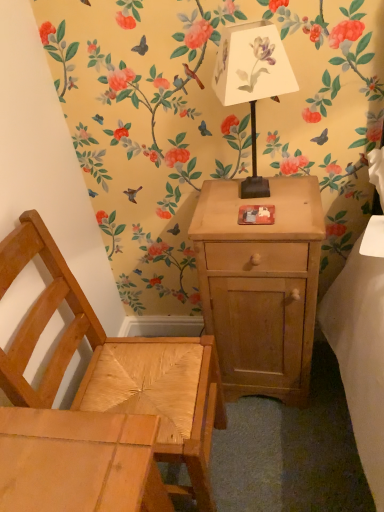
Question: From a real-world perspective, is natural wood chair at lower left below light brown wood nightstand at center?

Choices:
 (A) yes
 (B) no

Answer: (B)

Question: Is light brown wood nightstand at center a part of natural wood chair at lower left?

Choices:
 (A) no
 (B) yes

Answer: (A)

Question: Can you confirm if natural wood chair at lower left is positioned to the left of light brown wood nightstand at center?

Choices:
 (A) yes
 (B) no

Answer: (A)

Question: Can you confirm if natural wood chair at lower left is bigger than light brown wood nightstand at center?

Choices:
 (A) no
 (B) yes

Answer: (B)

Question: Does natural wood chair at lower left have a greater height compared to light brown wood nightstand at center?

Choices:
 (A) no
 (B) yes

Answer: (B)

Question: Is light brown wood nightstand at center inside or outside of white paper lampshade at upper center?

Choices:
 (A) outside
 (B) inside

Answer: (A)

Question: From a real-world perspective, relative to white paper lampshade at upper center, is light brown wood nightstand at center vertically above or below?

Choices:
 (A) below
 (B) above

Answer: (A)

Question: Is point (312, 267) closer or farther from the camera than point (225, 104)?

Choices:
 (A) farther
 (B) closer

Answer: (A)

Question: Is light brown wood nightstand at center to the left or to the right of white paper lampshade at upper center in the image?

Choices:
 (A) right
 (B) left

Answer: (A)

Question: From their relative heights in the image, would you say natural wood chair at lower left is taller or shorter than white paper lampshade at upper center?

Choices:
 (A) short
 (B) tall

Answer: (B)

Question: Is point (185, 441) positioned closer to the camera than point (251, 53)?

Choices:
 (A) farther
 (B) closer

Answer: (A)

Question: Based on their sizes in the image, would you say natural wood chair at lower left is bigger or smaller than white paper lampshade at upper center?

Choices:
 (A) small
 (B) big

Answer: (B)

Question: In terms of width, does natural wood chair at lower left look wider or thinner when compared to white paper lampshade at upper center?

Choices:
 (A) thin
 (B) wide

Answer: (B)

Question: From their relative heights in the image, would you say natural wood chair at lower left is taller or shorter than light brown wood nightstand at center?

Choices:
 (A) short
 (B) tall

Answer: (B)

Question: Is natural wood chair at lower left situated inside light brown wood nightstand at center or outside?

Choices:
 (A) outside
 (B) inside

Answer: (A)